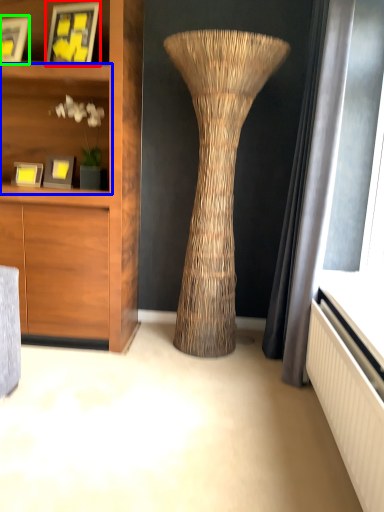
Question: Which object is the farthest from picture frame (highlighted by a red box)? Choose among these: shelf (highlighted by a blue box) or picture frame (highlighted by a green box).

Choices:
 (A) shelf
 (B) picture frame

Answer: (A)